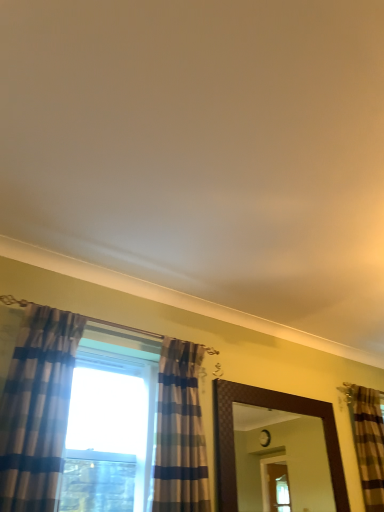
Question: From a real-world perspective, is brown textured mirror at center physically above plaid fabric curtain at left, placed as the third curtain when sorted from right to left?

Choices:
 (A) no
 (B) yes

Answer: (A)

Question: From the image's perspective, is brown textured mirror at center on top of plaid fabric curtain at left, placed as the first curtain when sorted from front to back?

Choices:
 (A) no
 (B) yes

Answer: (A)

Question: Is brown textured mirror at center looking in the opposite direction of plaid fabric curtain at left, placed as the first curtain when sorted from front to back?

Choices:
 (A) yes
 (B) no

Answer: (B)

Question: Does brown textured mirror at center turn towards plaid fabric curtain at left, placed as the first curtain when sorted from front to back?

Choices:
 (A) no
 (B) yes

Answer: (A)

Question: Considering the relative positions of brown textured mirror at center and plaid fabric curtain at left, placed as the third curtain when sorted from right to left, in the image provided, is brown textured mirror at center to the right of plaid fabric curtain at left, placed as the third curtain when sorted from right to left, from the viewer's perspective?

Choices:
 (A) no
 (B) yes

Answer: (B)

Question: Would you say brown striped curtain at right, the 1th curtain in the back-to-front sequence, is to the left or to the right of brown textured mirror at center in the picture?

Choices:
 (A) left
 (B) right

Answer: (B)

Question: Is brown striped curtain at right, which appears as the third curtain when viewed from the front, bigger or smaller than brown textured mirror at center?

Choices:
 (A) big
 (B) small

Answer: (B)

Question: Is brown striped curtain at right, positioned as the 3th curtain in left-to-right order, inside or outside of brown textured mirror at center?

Choices:
 (A) inside
 (B) outside

Answer: (B)

Question: From a real-world perspective, is brown striped curtain at right, the 1th curtain in the back-to-front sequence, positioned above or below brown textured mirror at center?

Choices:
 (A) above
 (B) below

Answer: (A)

Question: Is brown striped curtain at right, the 1th curtain in the back-to-front sequence, taller or shorter than plaid fabric curtain at left, placed as the first curtain when sorted from left to right?

Choices:
 (A) short
 (B) tall

Answer: (A)

Question: From a real-world perspective, is brown striped curtain at right, the 1th curtain in the back-to-front sequence, physically located above or below plaid fabric curtain at left, placed as the third curtain when sorted from right to left?

Choices:
 (A) above
 (B) below

Answer: (B)

Question: Based on their sizes in the image, would you say brown striped curtain at right, positioned as the 3th curtain in left-to-right order, is bigger or smaller than plaid fabric curtain at left, placed as the first curtain when sorted from left to right?

Choices:
 (A) small
 (B) big

Answer: (A)

Question: From the image's perspective, is brown striped curtain at right, positioned as the 3th curtain in left-to-right order, positioned above or below plaid fabric curtain at left, placed as the first curtain when sorted from left to right?

Choices:
 (A) above
 (B) below

Answer: (B)

Question: Is brown striped curtain at right, positioned as the 3th curtain in left-to-right order, wider or thinner than striped fabric curtain at center, which is the 2th curtain from left to right?

Choices:
 (A) wide
 (B) thin

Answer: (B)

Question: Would you say brown striped curtain at right, the 1th curtain when ordered from right to left, is to the left or to the right of striped fabric curtain at center, placed as the 2th curtain when sorted from front to back, in the picture?

Choices:
 (A) left
 (B) right

Answer: (B)